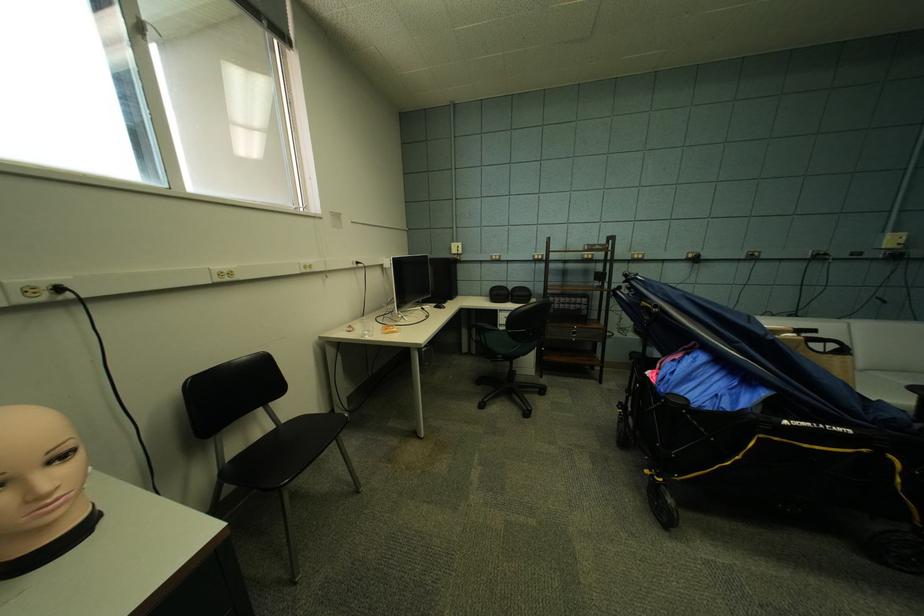
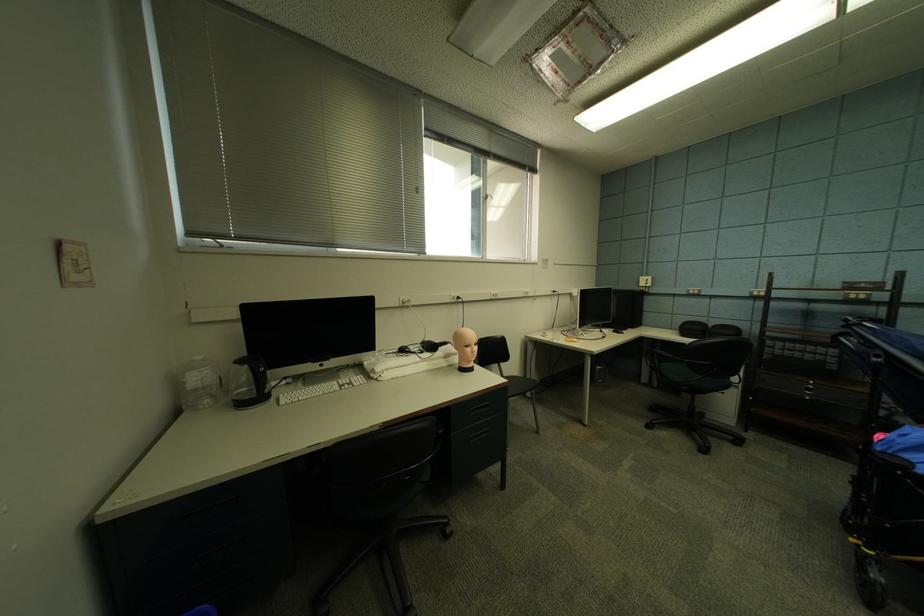
Find the pixel in the second image that matches point (235, 525) in the first image.

(517, 382)